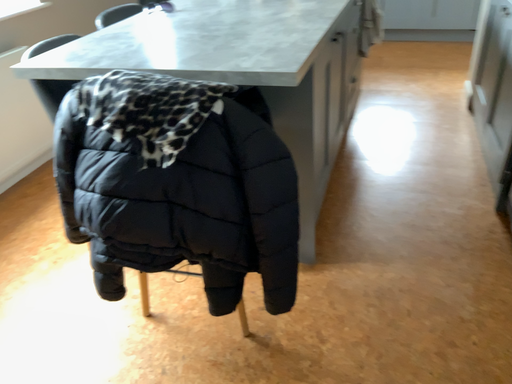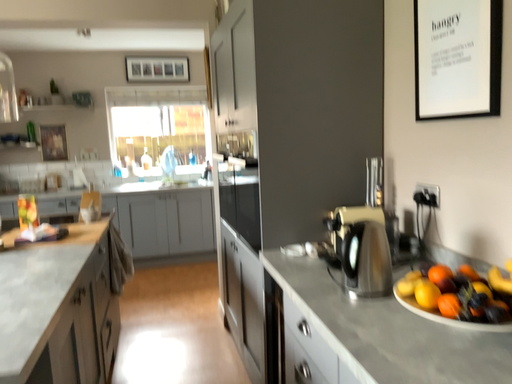
Question: How did the camera likely rotate when shooting the video?

Choices:
 (A) rotated right
 (B) rotated left

Answer: (A)